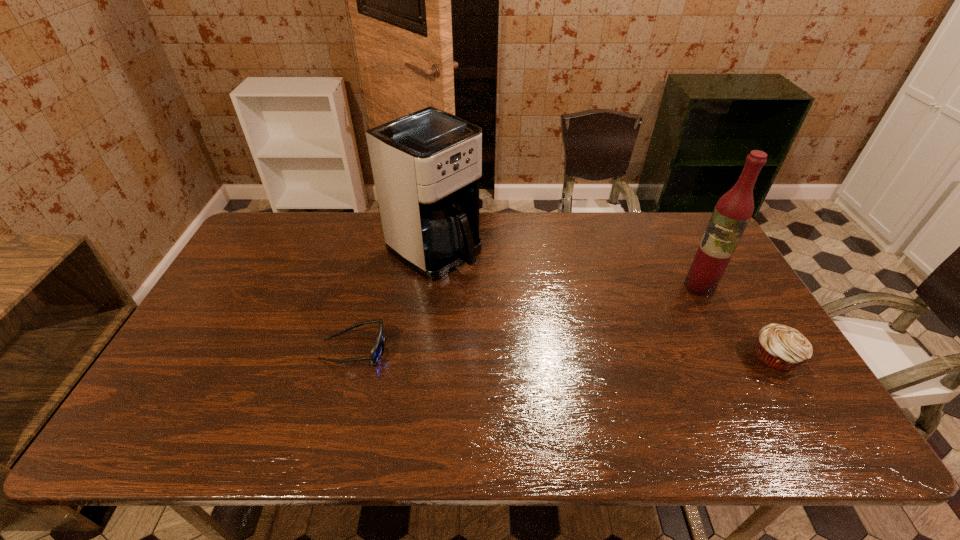
What are the coordinates of `the shortest object` in the screenshot? It's located at (377, 351).

Where is `muffin`? Image resolution: width=960 pixels, height=540 pixels. muffin is located at coordinates (782, 348).

This screenshot has height=540, width=960. I want to click on coffee maker, so 426,165.

Identify the location of liquor. (732, 213).

Where is `vacant area located 0.090m on the front-facing side of the sunglasses`? vacant area located 0.090m on the front-facing side of the sunglasses is located at coordinates (421, 349).

Locate an element on the screen. The image size is (960, 540). free space located 0.290m on the back of the muffin is located at coordinates (721, 267).

The image size is (960, 540). Find the location of `vacant space located on the front panel of the coffee maker`. vacant space located on the front panel of the coffee maker is located at coordinates [573, 340].

At what (x,y) coordinates should I click in order to perform the action: click on vacant space located 0.280m on the front panel of the coffee maker. Please return your answer as a coordinate pair (x, y). This screenshot has height=540, width=960. Looking at the image, I should click on (538, 317).

Identify the location of vacant space located on the front panel of the coffee maker. The image size is (960, 540). (521, 306).

You are a GUI agent. You are given a task and a screenshot of the screen. Output one action in this format:
    pyautogui.click(x=<x>, y=<y>)
    Task: Click on the free location located on the label of the liquor
    
    Given the screenshot: What is the action you would take?
    pyautogui.click(x=642, y=325)